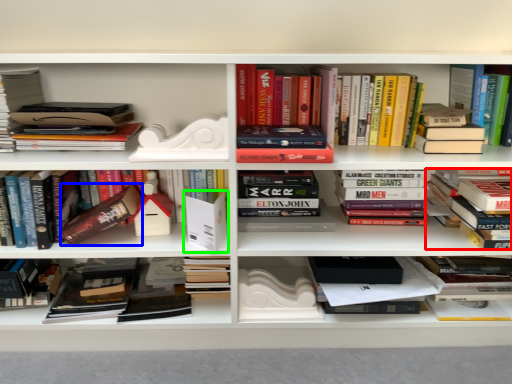
Question: Estimate the real-world distances between objects in this image. Which object is closer to book (highlighted by a red box), paperback book (highlighted by a blue box) or paperback book (highlighted by a green box)?

Choices:
 (A) paperback book
 (B) paperback book

Answer: (B)